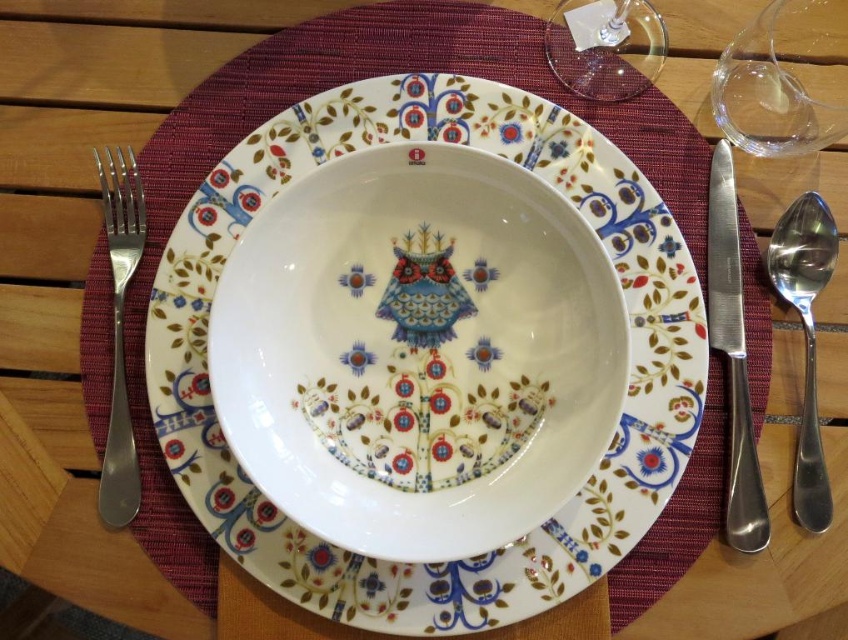
Question: Does satin silver fork at left have a lesser width compared to transparent glass wine glass at upper center?

Choices:
 (A) yes
 (B) no

Answer: (A)

Question: Among these objects, which one is nearest to the camera?

Choices:
 (A) polished silver spoon at right
 (B) satin silver fork at left
 (C) transparent glass wine glass at upper center
 (D) transparent glass wine glass at upper right

Answer: (D)

Question: Which of the following is the farthest from the observer?

Choices:
 (A) satin silver knife at right
 (B) polished silver spoon at right
 (C) transparent glass wine glass at upper center

Answer: (C)

Question: Which object is positioned farthest from the polished silver spoon at right?

Choices:
 (A) transparent glass wine glass at upper center
 (B) transparent glass wine glass at upper right
 (C) porcelain plate at center
 (D) satin silver fork at left

Answer: (D)

Question: Does porcelain plate at center appear under transparent glass wine glass at upper right?

Choices:
 (A) no
 (B) yes

Answer: (B)

Question: Can you confirm if satin silver knife at right is smaller than polished silver spoon at right?

Choices:
 (A) yes
 (B) no

Answer: (B)